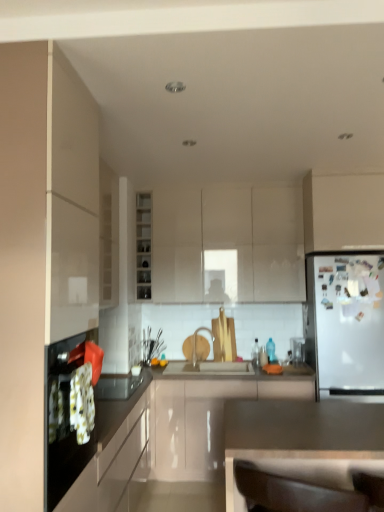
This screenshot has width=384, height=512. What do you see at coordinates (204, 422) in the screenshot?
I see `glossy white cabinet at center, positioned as the third cabinetry in back-to-front order` at bounding box center [204, 422].

What is the approximate height of matte white cabinet at center, the 5th cabinetry from the front?

It is 1.11 meters.

Measure the distance between point (220, 194) and camera.

3.91 meters.

What do you see at coordinates (343, 212) in the screenshot? I see `white glossy cabinet at upper right, which is the fourth cabinetry in back-to-front order` at bounding box center [343, 212].

Where is `matte gray countertop at center, acting as the 2th countertop starting from the back`? The image size is (384, 512). matte gray countertop at center, acting as the 2th countertop starting from the back is located at coordinates (299, 432).

Based on the photo, what is the approximate width of white glossy cabinet at center, which is the sixth cabinetry in front-to-back order?

white glossy cabinet at center, which is the sixth cabinetry in front-to-back order, is 31.29 centimeters in width.

At what (x,y) coordinates should I click in order to perform the action: click on glossy white cabinet at center, positioned as the third cabinetry in back-to-front order. Please return your answer as a coordinate pair (x, y). Looking at the image, I should click on (204, 422).

Can you confirm if white matte refrigerator at right is taller than matte white cabinet at center, the 5th cabinetry from the front?

Yes, white matte refrigerator at right is taller than matte white cabinet at center, the 5th cabinetry from the front.

Could you tell me if white matte refrigerator at right is facing matte white cabinet at center, the 5th cabinetry from the front?

No, white matte refrigerator at right is not oriented towards matte white cabinet at center, the 5th cabinetry from the front.

Is white matte refrigerator at right with matte white cabinet at center, the 5th cabinetry from the front?

No, white matte refrigerator at right is not next to matte white cabinet at center, the 5th cabinetry from the front.

Considering the sizes of white matte refrigerator at right and matte white cabinet at center, the second cabinetry in the back-to-front sequence, in the image, is white matte refrigerator at right wider or thinner than matte white cabinet at center, the second cabinetry in the back-to-front sequence,?

In the image, white matte refrigerator at right appears to be wider than matte white cabinet at center, the second cabinetry in the back-to-front sequence.

Which object is wider, matte white cabinet at center, the 5th cabinetry from the front, or black glossy oven at left, which appears as the second cabinetry when viewed from the front?

black glossy oven at left, which appears as the second cabinetry when viewed from the front.

Is matte white cabinet at center, the 5th cabinetry from the front, aimed at black glossy oven at left, the 5th cabinetry viewed from the back?

No, matte white cabinet at center, the 5th cabinetry from the front, does not turn towards black glossy oven at left, the 5th cabinetry viewed from the back.

From the image's perspective, is matte white cabinet at center, the second cabinetry in the back-to-front sequence, located above or below black glossy oven at left, which appears as the second cabinetry when viewed from the front?

Clearly, from the image's perspective, matte white cabinet at center, the second cabinetry in the back-to-front sequence, is above black glossy oven at left, which appears as the second cabinetry when viewed from the front.

Is matte white cabinet at center, the 5th cabinetry from the front, not near black glossy oven at left, the 5th cabinetry viewed from the back?

Absolutely, matte white cabinet at center, the 5th cabinetry from the front, is distant from black glossy oven at left, the 5th cabinetry viewed from the back.

Identify the location of countertop that is the 2nd one when counting leftward from the white glossy cabinet at upper right, which is the fourth cabinetry in back-to-front order. (172, 439).

What's the angular difference between glossy white countertop at lower center, positioned as the 1th countertop in back-to-front order, and white glossy cabinet at upper right, which is the fourth cabinetry in back-to-front order,'s facing directions?

The facing directions of glossy white countertop at lower center, positioned as the 1th countertop in back-to-front order, and white glossy cabinet at upper right, which is the fourth cabinetry in back-to-front order, are 90 degrees apart.

Between glossy white countertop at lower center, arranged as the 2th countertop when viewed from the front, and white glossy cabinet at upper right, which is the fourth cabinetry in back-to-front order, which one has larger width?

Wider between the two is glossy white countertop at lower center, arranged as the 2th countertop when viewed from the front.

Could you tell me if glossy white countertop at lower center, positioned as the 1th countertop in back-to-front order, is facing white glossy cabinet at upper right, the third cabinetry when ordered from front to back?

No, glossy white countertop at lower center, positioned as the 1th countertop in back-to-front order, is not facing towards white glossy cabinet at upper right, the third cabinetry when ordered from front to back.

Is matte white cabinet at left, positioned as the sixth cabinetry in back-to-front order, behind white glossy cabinet at upper right, the third cabinetry when ordered from front to back?

No.

Is matte white cabinet at left, positioned as the sixth cabinetry in back-to-front order, smaller than white glossy cabinet at upper right, which is the fourth cabinetry in back-to-front order?

No, matte white cabinet at left, positioned as the sixth cabinetry in back-to-front order, is not smaller than white glossy cabinet at upper right, which is the fourth cabinetry in back-to-front order.

Is matte white cabinet at left, arranged as the 1th cabinetry when viewed from the front, to the right of white glossy cabinet at upper right, which is the fourth cabinetry in back-to-front order, from the viewer's perspective?

No.

From a real-world perspective, which is physically above, matte white cabinet at left, arranged as the 1th cabinetry when viewed from the front, or white glossy cabinet at upper right, the third cabinetry when ordered from front to back?

white glossy cabinet at upper right, the third cabinetry when ordered from front to back, is physically above.

Which is behind, point (221, 189) or point (279, 381)?

The point (221, 189) is behind.

Considering the positions of objects matte white cabinet at center, the second cabinetry in the back-to-front sequence, and glossy white countertop at lower center, positioned as the 1th countertop in back-to-front order, in the image provided, who is more to the right, matte white cabinet at center, the second cabinetry in the back-to-front sequence, or glossy white countertop at lower center, positioned as the 1th countertop in back-to-front order,?

Positioned to the right is matte white cabinet at center, the second cabinetry in the back-to-front sequence.

Is matte white cabinet at center, the 5th cabinetry from the front, far from glossy white countertop at lower center, positioned as the 1th countertop in back-to-front order?

Absolutely, matte white cabinet at center, the 5th cabinetry from the front, is distant from glossy white countertop at lower center, positioned as the 1th countertop in back-to-front order.

The image size is (384, 512). I want to click on the 1st cabinetry counting from the right side of the white glossy cabinet at center, acting as the first cabinetry starting from the back, so click(204, 422).

Can you tell me how much glossy white cabinet at center, which is the 4th cabinetry in front-to-back order, and white glossy cabinet at center, acting as the first cabinetry starting from the back, differ in facing direction?

glossy white cabinet at center, which is the 4th cabinetry in front-to-back order, and white glossy cabinet at center, acting as the first cabinetry starting from the back, are facing 0.000894 degrees away from each other.

Considering the relative sizes of glossy white cabinet at center, positioned as the third cabinetry in back-to-front order, and white glossy cabinet at center, acting as the first cabinetry starting from the back, in the image provided, is glossy white cabinet at center, positioned as the third cabinetry in back-to-front order, thinner than white glossy cabinet at center, acting as the first cabinetry starting from the back,?

Incorrect, the width of glossy white cabinet at center, positioned as the third cabinetry in back-to-front order, is not less than that of white glossy cabinet at center, acting as the first cabinetry starting from the back.

Do you think glossy white cabinet at center, positioned as the third cabinetry in back-to-front order, is within white glossy cabinet at center, acting as the first cabinetry starting from the back, or outside of it?

The correct answer is: outside.

Does point (189, 405) come behind point (69, 180)?

Yes, point (189, 405) is farther from viewer.

Are glossy white cabinet at center, which is the 4th cabinetry in front-to-back order, and matte white cabinet at left, arranged as the 1th cabinetry when viewed from the front, located far from each other?

Yes, glossy white cabinet at center, which is the 4th cabinetry in front-to-back order, and matte white cabinet at left, arranged as the 1th cabinetry when viewed from the front, are quite far apart.

Considering the relative sizes of glossy white cabinet at center, which is the 4th cabinetry in front-to-back order, and matte white cabinet at left, arranged as the 1th cabinetry when viewed from the front, in the image provided, is glossy white cabinet at center, which is the 4th cabinetry in front-to-back order, smaller than matte white cabinet at left, arranged as the 1th cabinetry when viewed from the front,?

Incorrect, glossy white cabinet at center, which is the 4th cabinetry in front-to-back order, is not smaller in size than matte white cabinet at left, arranged as the 1th cabinetry when viewed from the front.

Relative to matte white cabinet at left, positioned as the sixth cabinetry in back-to-front order, is glossy white cabinet at center, positioned as the third cabinetry in back-to-front order, in front or behind?

Clearly, glossy white cabinet at center, positioned as the third cabinetry in back-to-front order, is behind matte white cabinet at left, positioned as the sixth cabinetry in back-to-front order.

Image resolution: width=384 pixels, height=512 pixels. What are the coordinates of `refrigerator on the right of matte white cabinet at center, the second cabinetry in the back-to-front sequence` in the screenshot? It's located at (346, 323).

Locate an element on the screen. This screenshot has width=384, height=512. the 3rd cabinetry below the matte white cabinet at center, the 5th cabinetry from the front (from the image's perspective) is located at coordinates (113, 452).

Looking at the image, which one is located closer to glossy white countertop at lower center, arranged as the 2th countertop when viewed from the front, matte white cabinet at center, the 5th cabinetry from the front, or glossy white cabinet at center, which is the 4th cabinetry in front-to-back order?

glossy white cabinet at center, which is the 4th cabinetry in front-to-back order, lies closer to glossy white countertop at lower center, arranged as the 2th countertop when viewed from the front, than the other object.

Considering their positions, is white glossy cabinet at upper right, which is the fourth cabinetry in back-to-front order, positioned closer to glossy white cabinet at center, which is the 4th cabinetry in front-to-back order, than black glossy oven at left, the 5th cabinetry viewed from the back?

black glossy oven at left, the 5th cabinetry viewed from the back, is closer to glossy white cabinet at center, which is the 4th cabinetry in front-to-back order.

Which object lies nearer to the anchor point white matte refrigerator at right, matte white cabinet at left, positioned as the sixth cabinetry in back-to-front order, or black glossy oven at left, the 5th cabinetry viewed from the back?

The object closer to white matte refrigerator at right is black glossy oven at left, the 5th cabinetry viewed from the back.

Estimate the real-world distances between objects in this image. Which object is closer to matte white cabinet at center, the second cabinetry in the back-to-front sequence, matte gray countertop at center, acting as the 2th countertop starting from the back, or white glossy cabinet at upper right, which is the fourth cabinetry in back-to-front order?

The object closer to matte white cabinet at center, the second cabinetry in the back-to-front sequence, is white glossy cabinet at upper right, which is the fourth cabinetry in back-to-front order.

From the image, which object appears to be nearer to matte white cabinet at center, the second cabinetry in the back-to-front sequence, white glossy cabinet at upper right, which is the fourth cabinetry in back-to-front order, or white matte refrigerator at right?

Among the two, white glossy cabinet at upper right, which is the fourth cabinetry in back-to-front order, is located nearer to matte white cabinet at center, the second cabinetry in the back-to-front sequence.

Considering their positions, is matte white cabinet at left, positioned as the sixth cabinetry in back-to-front order, positioned further to white glossy cabinet at upper right, the third cabinetry when ordered from front to back, than white matte refrigerator at right?

matte white cabinet at left, positioned as the sixth cabinetry in back-to-front order, is positioned further to the anchor white glossy cabinet at upper right, the third cabinetry when ordered from front to back.

When comparing their distances from matte gray countertop at center, acting as the 2th countertop starting from the back, does white matte refrigerator at right or glossy white countertop at lower center, arranged as the 2th countertop when viewed from the front, seem further?

white matte refrigerator at right is further to matte gray countertop at center, acting as the 2th countertop starting from the back.

Based on their spatial positions, is black glossy oven at left, which appears as the second cabinetry when viewed from the front, or white glossy cabinet at center, which is the sixth cabinetry in front-to-back order, further from glossy white cabinet at center, positioned as the third cabinetry in back-to-front order?

white glossy cabinet at center, which is the sixth cabinetry in front-to-back order, lies further to glossy white cabinet at center, positioned as the third cabinetry in back-to-front order, than the other object.

At what (x,y) coordinates should I click in order to perform the action: click on refrigerator between matte gray countertop at center, acting as the 2th countertop starting from the back, and white glossy cabinet at upper right, the third cabinetry when ordered from front to back, along the z-axis. Please return your answer as a coordinate pair (x, y). Looking at the image, I should click on (346, 323).

The width and height of the screenshot is (384, 512). Identify the location of refrigerator between matte gray countertop at center, acting as the 2th countertop starting from the back, and white glossy cabinet at center, which is the sixth cabinetry in front-to-back order, in the front-back direction. (346, 323).

Find the location of a particular element. The width and height of the screenshot is (384, 512). refrigerator that lies between matte white cabinet at center, the 5th cabinetry from the front, and glossy white cabinet at center, positioned as the third cabinetry in back-to-front order, from top to bottom is located at coordinates (346, 323).

Identify the location of refrigerator located between glossy white countertop at lower center, positioned as the 1th countertop in back-to-front order, and white glossy cabinet at center, which is the sixth cabinetry in front-to-back order, in the depth direction. The width and height of the screenshot is (384, 512). (346, 323).